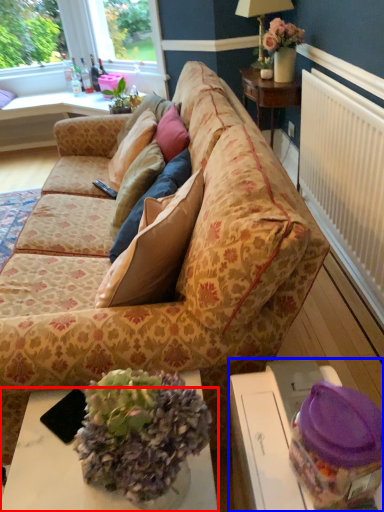
Question: Among these objects, which one is nearest to the camera, desk (highlighted by a red box) or table (highlighted by a blue box)?

Choices:
 (A) desk
 (B) table

Answer: (B)